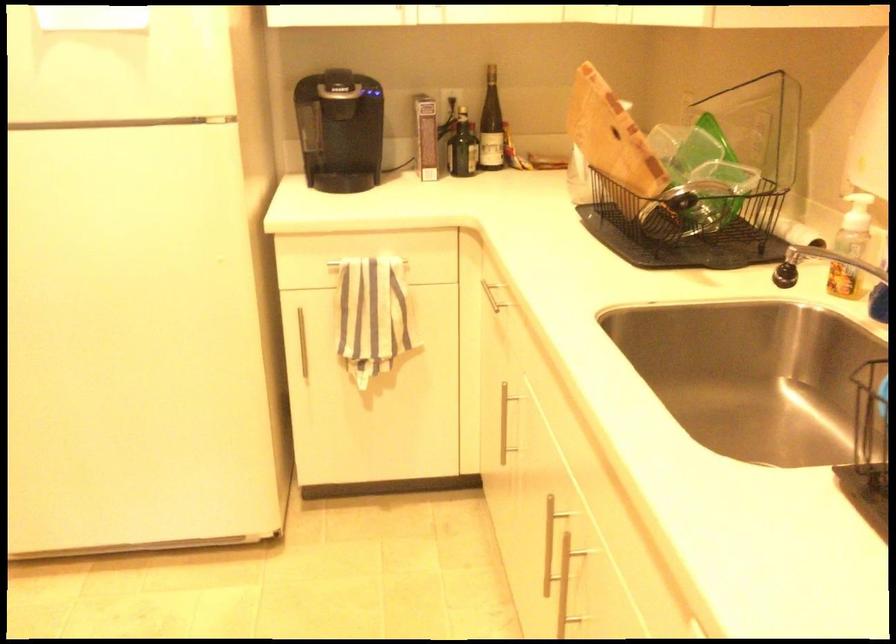
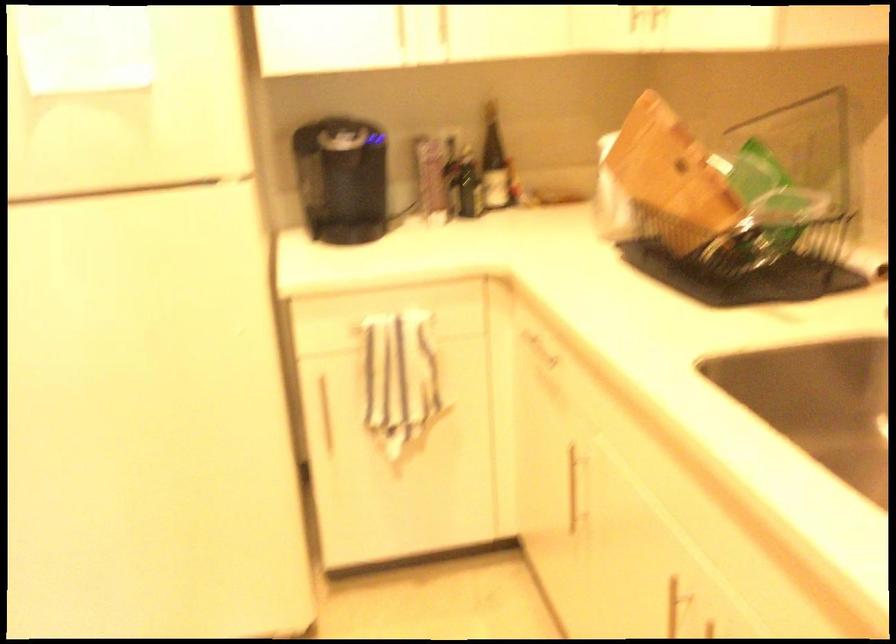
Locate, in the second image, the point that corresponds to point 492,124 in the first image.

(494, 163)